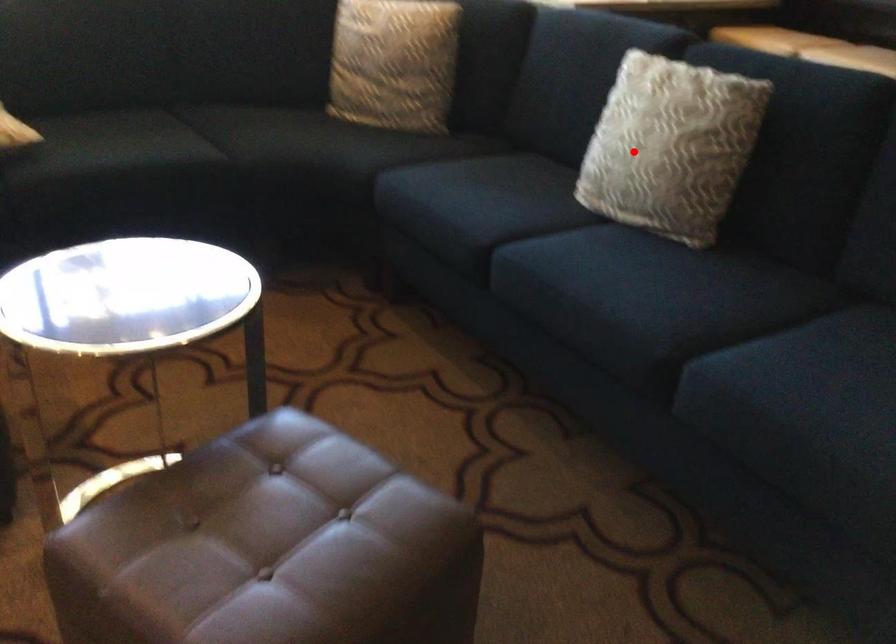
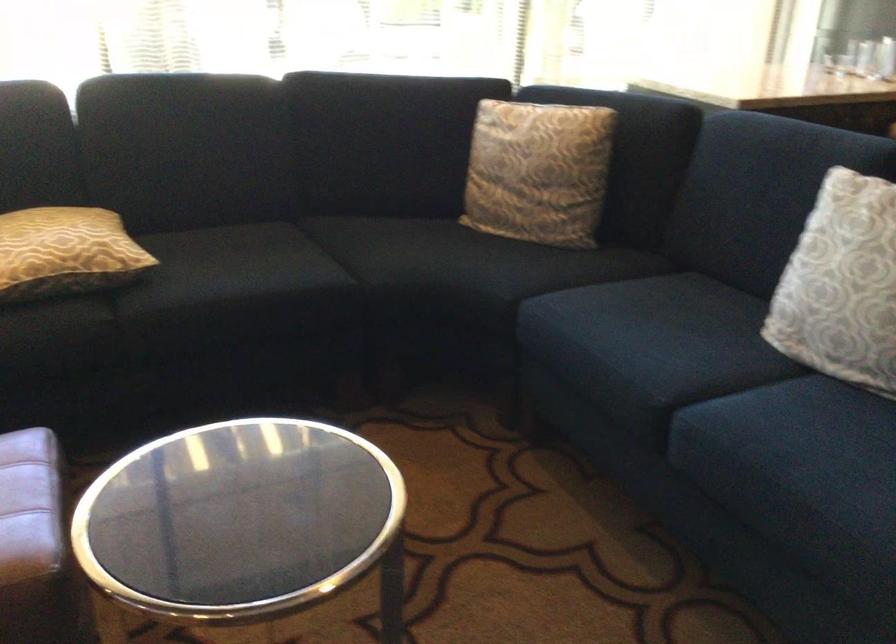
Locate, in the second image, the point that corresponds to the highlighted location in the first image.

(841, 285)